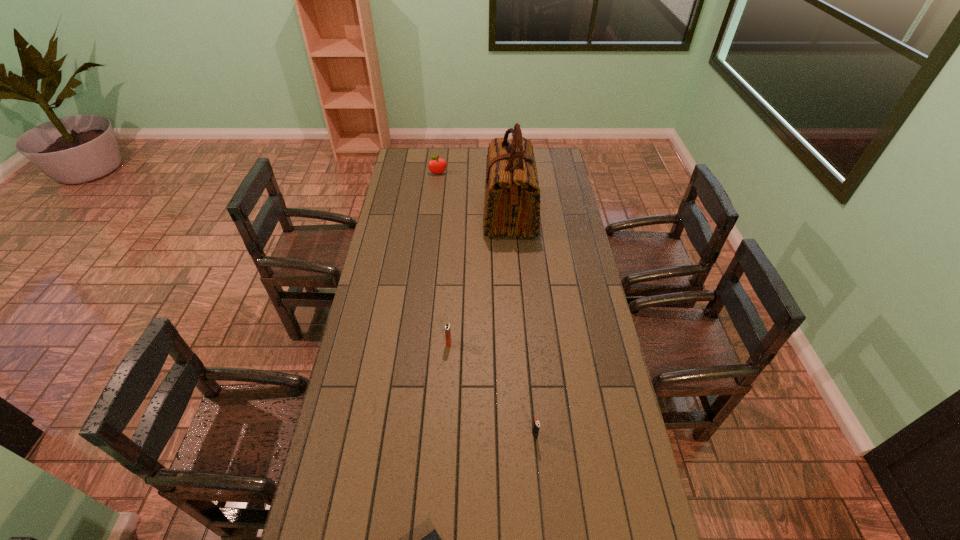
Find the location of a particular element. The height and width of the screenshot is (540, 960). the tallest object is located at coordinates (512, 201).

This screenshot has width=960, height=540. Find the location of `shopping bag`. shopping bag is located at coordinates pos(512,201).

Image resolution: width=960 pixels, height=540 pixels. I want to click on apple, so click(437, 166).

I want to click on the farther igniter, so click(447, 327).

Image resolution: width=960 pixels, height=540 pixels. I want to click on the third farthest object, so click(447, 327).

Locate an element on the screen. This screenshot has width=960, height=540. the second nearest object is located at coordinates (536, 425).

Where is `the second shortest object`? The height and width of the screenshot is (540, 960). the second shortest object is located at coordinates (536, 425).

Locate an element on the screen. free space located 0.120m on the open handle side of the shopping bag is located at coordinates (456, 214).

The height and width of the screenshot is (540, 960). What are the coordinates of `free space located on the open handle side of the shopping bag` in the screenshot? It's located at 415,214.

Identify the location of free space located on the open handle side of the shopping bag. The height and width of the screenshot is (540, 960). (423, 214).